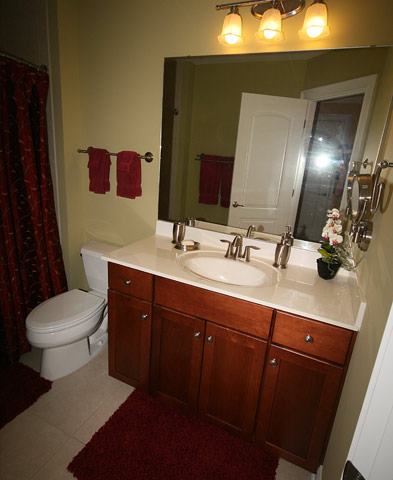
This screenshot has width=393, height=480. I want to click on mirror, so click(x=333, y=183).